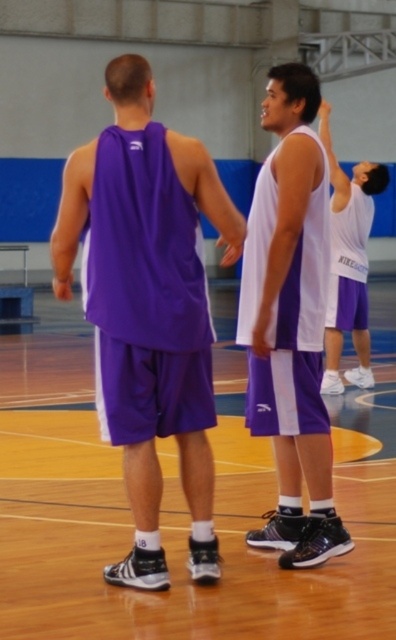
Which of these two, purple fabric tank top at center or white matte tank top at center, stands taller?

white matte tank top at center

Is purple fabric tank top at center to the right of white matte tank top at center from the viewer's perspective?

Incorrect, purple fabric tank top at center is not on the right side of white matte tank top at center.

Does point (125, 358) come in front of point (251, 220)?

Yes.

Where is `purple fabric tank top at center`? The width and height of the screenshot is (396, 640). purple fabric tank top at center is located at coordinates (148, 307).

Is white matte tank top at center below white matte basketball jersey at upper right?

Incorrect, white matte tank top at center is not positioned below white matte basketball jersey at upper right.

Measure the distance between point (291, 278) and camera.

6.41 meters

Identify the location of white matte tank top at center. Image resolution: width=396 pixels, height=640 pixels. (291, 321).

Image resolution: width=396 pixels, height=640 pixels. Describe the element at coordinates (148, 307) in the screenshot. I see `purple fabric tank top at center` at that location.

Who is positioned more to the right, purple fabric tank top at center or white matte basketball jersey at upper right?

Positioned to the right is white matte basketball jersey at upper right.

Is point (209, 156) positioned in front of point (344, 220)?

Yes, it is in front of point (344, 220).

The image size is (396, 640). Find the location of `purple fabric tank top at center`. purple fabric tank top at center is located at coordinates (148, 307).